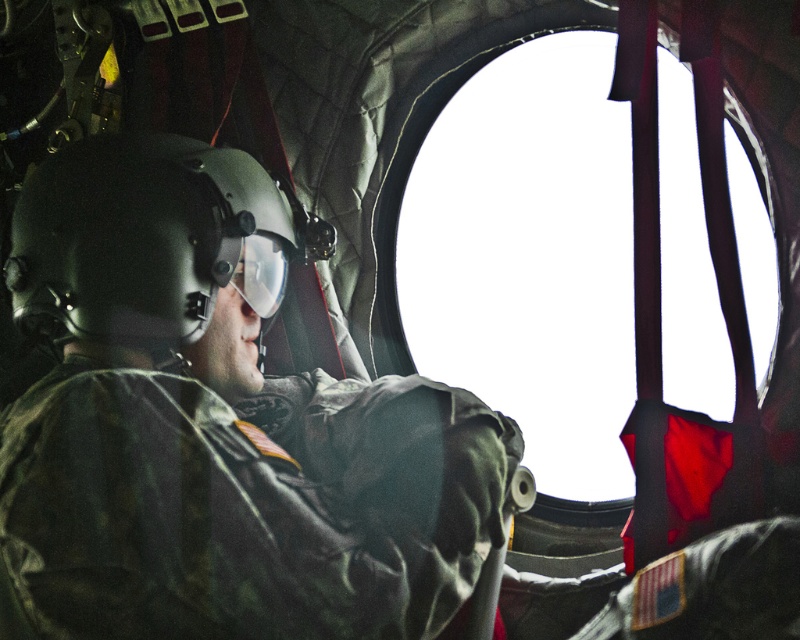
You are a flight engineer inspecting the cockpit of this military aircraft. You notice the matte black helmet at center and the transparent glass window at center. Which object has a greater height in the image?

The transparent glass window at center is taller than the matte black helmet at center, so the transparent glass window at center has a greater height.

You are a military aircraft inspector checking the cockpit layout. You notice the matte black helmet at center and the transparent glass window at center. According to the cockpit design, which object is positioned to the left of the other?

The matte black helmet at center is to the left of the transparent glass window at center.

You are a technician inspecting the cockpit of this military aircraft. You need to access the matte black helmet at center for maintenance. From your current position at point 0,0, which direction should you move to reach the helmet?

The matte black helmet at center is located at point (216, 426), so you should move towards the right and slightly forward to reach it.